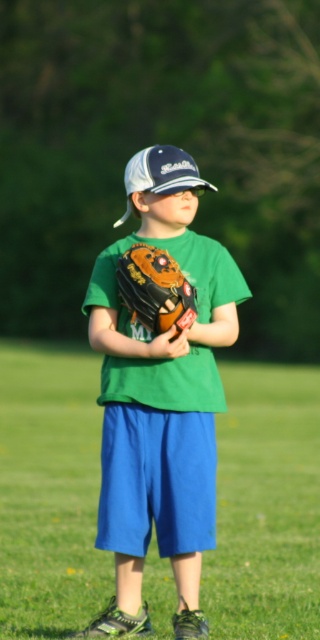
You are a photographer trying to capture a closeup of the green matte baseball glove at center. Since the green grass at center is in the way, can you adjust your camera angle to focus on the glove without moving the grass?

The green grass at center is bigger than the green matte baseball glove at center, so you can lower your camera angle to position the smaller glove above the grass and achieve focus.

The boy is holding two items at the center of the image. Which one is shorter in height between the green matte baseball glove at center and the white matte baseball cap at center?

The green matte baseball glove at center has a lesser height compared to the white matte baseball cap at center, so the green matte baseball glove at center is shorter.